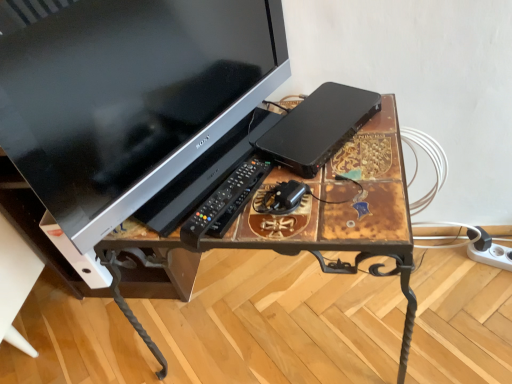
Where is `free space in front of black plastic computer at center`? This screenshot has height=384, width=512. free space in front of black plastic computer at center is located at coordinates (341, 190).